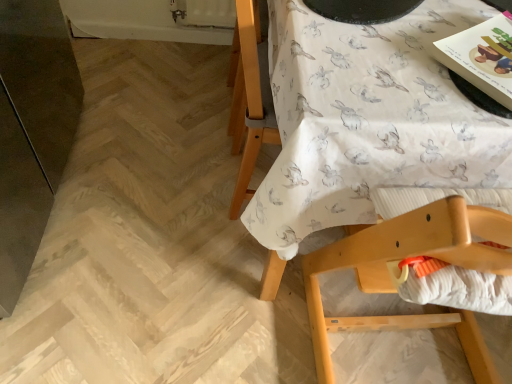
Question: Can you confirm if white fabric with rabbit print at upper right is shorter than white textured fabric at lower right?

Choices:
 (A) yes
 (B) no

Answer: (B)

Question: Does white fabric with rabbit print at upper right appear on the left side of white textured fabric at lower right?

Choices:
 (A) yes
 (B) no

Answer: (B)

Question: Considering the relative positions of white fabric with rabbit print at upper right and white textured fabric at lower right in the image provided, is white fabric with rabbit print at upper right behind white textured fabric at lower right?

Choices:
 (A) no
 (B) yes

Answer: (B)

Question: Is white fabric with rabbit print at upper right with white textured fabric at lower right?

Choices:
 (A) no
 (B) yes

Answer: (A)

Question: From the image's perspective, is white fabric with rabbit print at upper right located above white textured fabric at lower right?

Choices:
 (A) yes
 (B) no

Answer: (A)

Question: Considering the relative positions of white fabric with rabbit print at upper right and white textured fabric at lower right in the image provided, is white fabric with rabbit print at upper right to the right of white textured fabric at lower right from the viewer's perspective?

Choices:
 (A) no
 (B) yes

Answer: (B)

Question: Is wooden highchair at upper right located within matte paper magazine at upper right?

Choices:
 (A) no
 (B) yes

Answer: (A)

Question: Does matte paper magazine at upper right have a lesser height compared to wooden highchair at upper right?

Choices:
 (A) yes
 (B) no

Answer: (A)

Question: Considering the relative sizes of matte paper magazine at upper right and wooden highchair at upper right in the image provided, is matte paper magazine at upper right bigger than wooden highchair at upper right?

Choices:
 (A) no
 (B) yes

Answer: (A)

Question: Can we say matte paper magazine at upper right lies outside wooden highchair at upper right?

Choices:
 (A) yes
 (B) no

Answer: (B)

Question: Could you tell me if matte paper magazine at upper right is facing wooden highchair at upper right?

Choices:
 (A) no
 (B) yes

Answer: (B)

Question: Does matte paper magazine at upper right have a greater height compared to wooden highchair at upper right?

Choices:
 (A) no
 (B) yes

Answer: (A)

Question: From the image's perspective, does wooden highchair at upper right appear higher than white fabric with rabbit print at upper right?

Choices:
 (A) no
 (B) yes

Answer: (A)